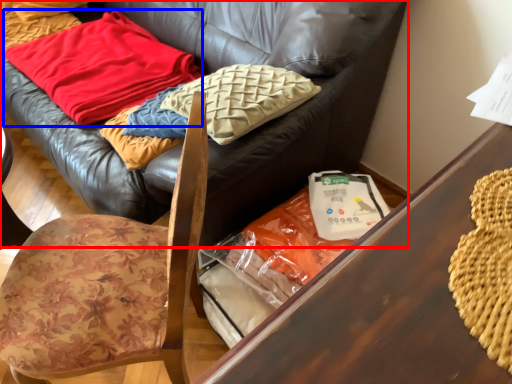
Question: Which of the following is the farthest to the observer, studio couch (highlighted by a red box) or blanket (highlighted by a blue box)?

Choices:
 (A) studio couch
 (B) blanket

Answer: (B)